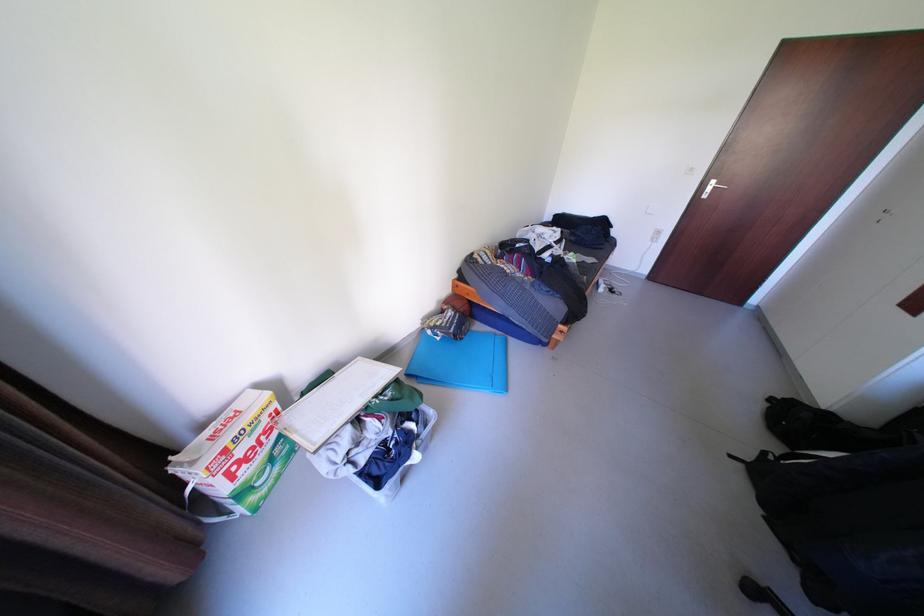
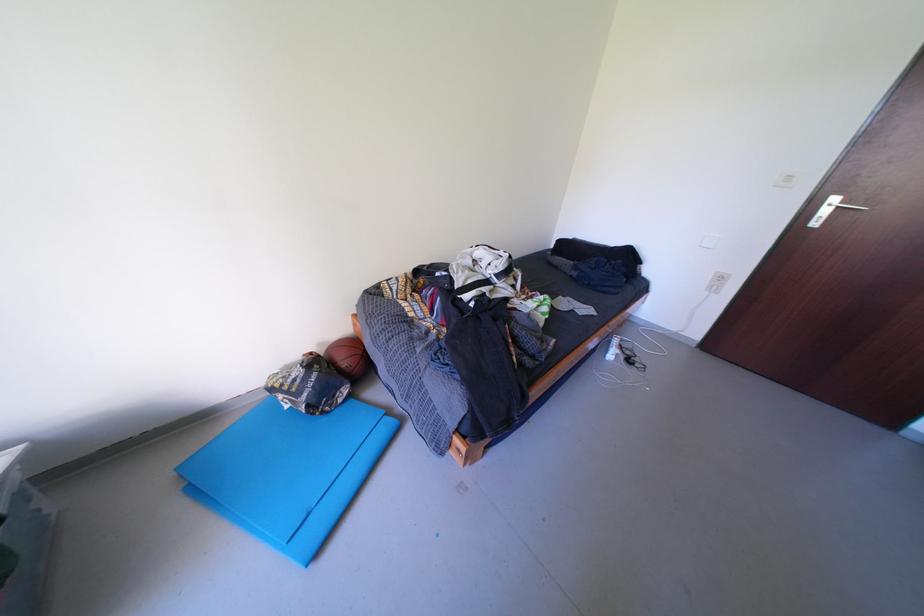
Which direction would the cameraman need to move to produce the second image?

The cameraman walked toward right, forward.